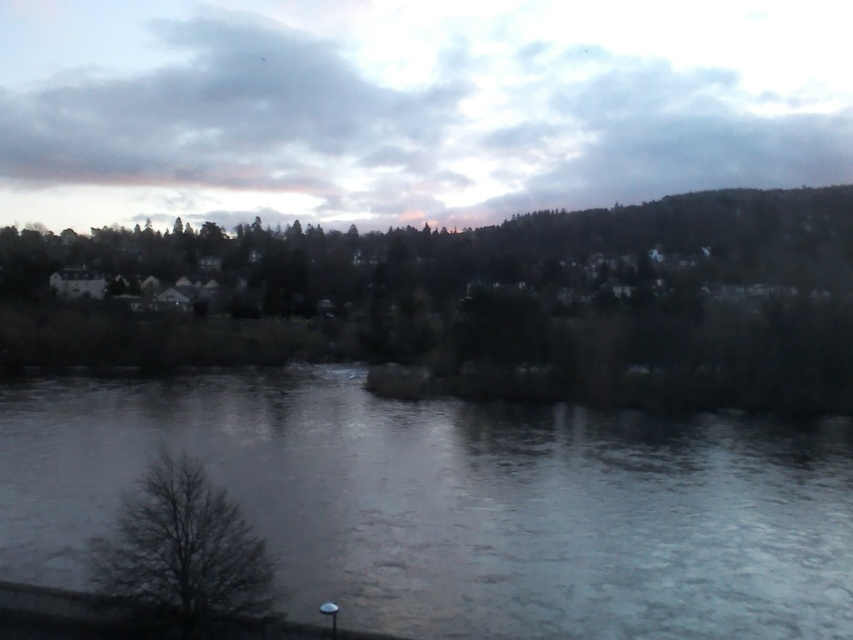
Can you confirm if gray ice at center is shorter than green matte tree at center?

Yes, gray ice at center is shorter than green matte tree at center.

Who is shorter, gray ice at center or green matte tree at center?

With less height is gray ice at center.

What do you see at coordinates (457, 502) in the screenshot? This screenshot has width=853, height=640. I see `gray ice at center` at bounding box center [457, 502].

You are a GUI agent. You are given a task and a screenshot of the screen. Output one action in this format:
    pyautogui.click(x=<x>, y=<y>)
    Task: Click on the gray ice at center
    
    Given the screenshot: What is the action you would take?
    pyautogui.click(x=457, y=502)

Is point (585, 545) less distant than point (166, 529)?

No, it is not.

Looking at this image, does gray ice at center come behind bare branches at lower left?

Yes, it is behind bare branches at lower left.

Who is more distant from viewer, (314, 464) or (177, 477)?

The point (314, 464) is behind.

Identify the location of gray ice at center. The image size is (853, 640). (457, 502).

Is point (711, 378) positioned before point (142, 547)?

No, (711, 378) is behind (142, 547).

How far apart are green matte tree at center and bare branches at lower left?

The distance of green matte tree at center from bare branches at lower left is 82.30 meters.

You are a GUI agent. You are given a task and a screenshot of the screen. Output one action in this format:
    pyautogui.click(x=<x>, y=<y>)
    Task: Click on the green matte tree at center
    This screenshot has width=853, height=640.
    Given the screenshot: What is the action you would take?
    pyautogui.click(x=476, y=300)

Locate an element on the screen. The height and width of the screenshot is (640, 853). green matte tree at center is located at coordinates (476, 300).